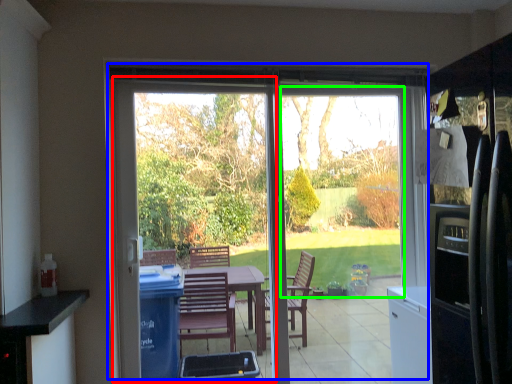
Question: Which object is positioned closest to screen door (highlighted by a red box)? Select from door (highlighted by a blue box) and window screen (highlighted by a green box).

Choices:
 (A) door
 (B) window screen

Answer: (A)